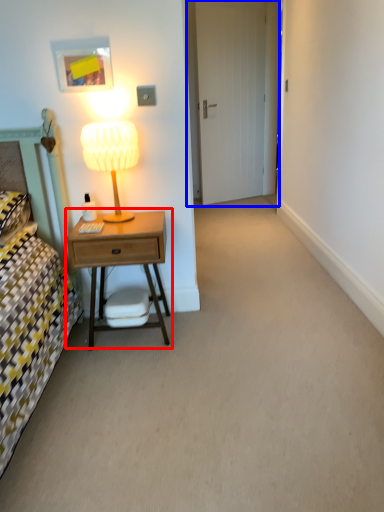
Question: Which object is closer to the camera taking this photo, nightstand (highlighted by a red box) or door (highlighted by a blue box)?

Choices:
 (A) nightstand
 (B) door

Answer: (A)